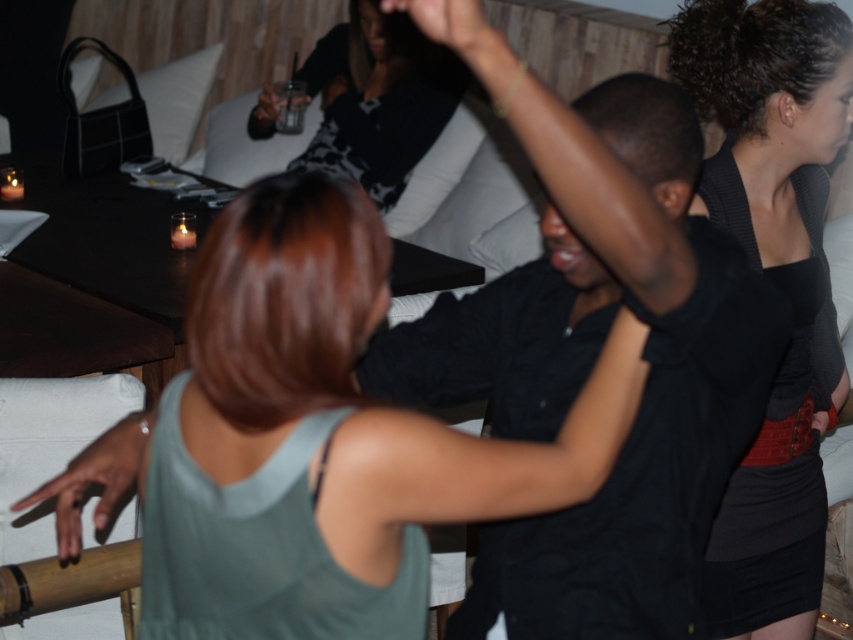
Question: Does black knit dress at upper right have a smaller size compared to black matte dress at upper right?

Choices:
 (A) no
 (B) yes

Answer: (A)

Question: Does black knit dress at upper right have a larger size compared to black jersey top at upper center?

Choices:
 (A) yes
 (B) no

Answer: (B)

Question: Which of these objects is positioned farthest from the clear plastic cup at upper center?

Choices:
 (A) dark skin hand at lower left
 (B) black matte dress at upper right
 (C) black jersey top at upper center
 (D) matte black phone at upper center

Answer: (D)

Question: Which object is farther from the camera taking this photo?

Choices:
 (A) black matte dress at upper right
 (B) matte black phone at upper center
 (C) black knit dress at upper right
 (D) dark skin hand at lower left

Answer: (A)

Question: Does matte black phone at upper center have a greater width compared to clear plastic cup at upper center?

Choices:
 (A) yes
 (B) no

Answer: (B)

Question: Among these objects, which one is nearest to the camera?

Choices:
 (A) clear plastic cup at upper center
 (B) black knit dress at upper right
 (C) black jersey top at upper center

Answer: (B)